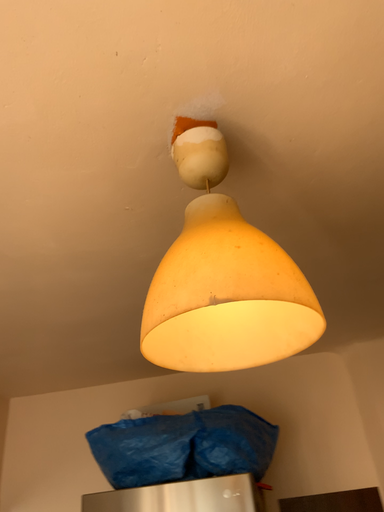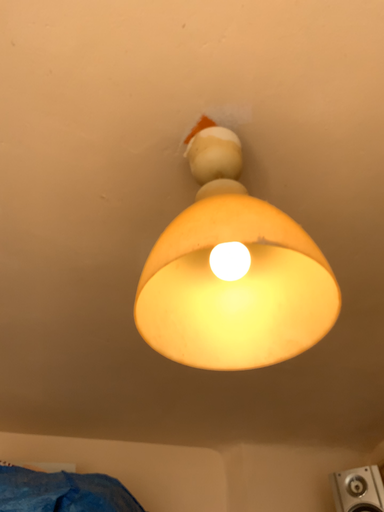
Question: Which way did the camera rotate in the video?

Choices:
 (A) rotated left
 (B) rotated right

Answer: (B)